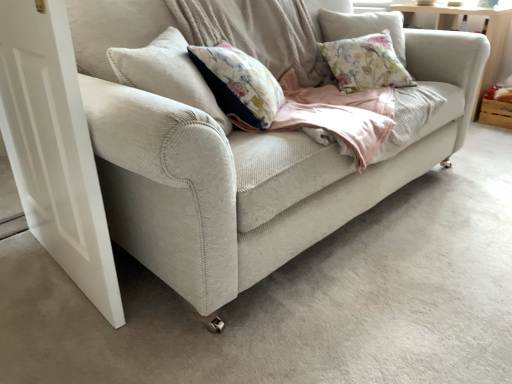
Question: Does white matte door at left have a lesser width compared to wooden crate at right?

Choices:
 (A) yes
 (B) no

Answer: (A)

Question: Considering the relative sizes of white matte door at left and wooden crate at right in the image provided, is white matte door at left wider than wooden crate at right?

Choices:
 (A) no
 (B) yes

Answer: (A)

Question: Does white matte door at left appear on the right side of wooden crate at right?

Choices:
 (A) yes
 (B) no

Answer: (B)

Question: Is white matte door at left taller than wooden crate at right?

Choices:
 (A) yes
 (B) no

Answer: (A)

Question: Would you consider white matte door at left to be distant from wooden crate at right?

Choices:
 (A) no
 (B) yes

Answer: (B)

Question: Considering the positions of light beige fabric couch at center and white matte door at left in the image, is light beige fabric couch at center taller or shorter than white matte door at left?

Choices:
 (A) tall
 (B) short

Answer: (B)

Question: From a real-world perspective, is light beige fabric couch at center above or below white matte door at left?

Choices:
 (A) above
 (B) below

Answer: (A)

Question: Considering the positions of point (221, 254) and point (12, 48), is point (221, 254) closer or farther from the camera than point (12, 48)?

Choices:
 (A) closer
 (B) farther

Answer: (A)

Question: Relative to white matte door at left, is light beige fabric couch at center in front or behind?

Choices:
 (A) front
 (B) behind

Answer: (A)

Question: In terms of width, does light beige fabric couch at center look wider or thinner when compared to wooden crate at right?

Choices:
 (A) wide
 (B) thin

Answer: (A)

Question: Relative to wooden crate at right, is light beige fabric couch at center in front or behind?

Choices:
 (A) front
 (B) behind

Answer: (A)

Question: In terms of height, does light beige fabric couch at center look taller or shorter compared to wooden crate at right?

Choices:
 (A) short
 (B) tall

Answer: (B)

Question: From the image's perspective, is light beige fabric couch at center positioned above or below wooden crate at right?

Choices:
 (A) above
 (B) below

Answer: (B)

Question: Choose the correct answer: Is wooden crate at right inside white matte door at left or outside it?

Choices:
 (A) outside
 (B) inside

Answer: (A)

Question: Is wooden crate at right bigger or smaller than white matte door at left?

Choices:
 (A) small
 (B) big

Answer: (A)